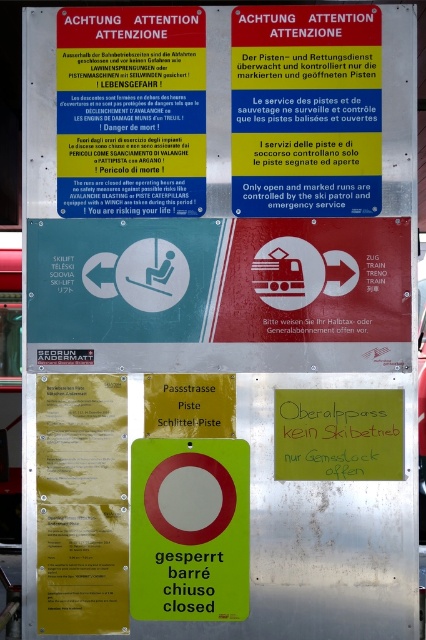
Question: Which object appears closest to the camera in this image?

Choices:
 (A) green matte sign at center
 (B) green paper sign at center

Answer: (A)

Question: Can you confirm if red plastic sign at upper center is positioned below green paper sign at center?

Choices:
 (A) yes
 (B) no

Answer: (B)

Question: Where is green matte sign at center located in relation to green paper sign at center in the image?

Choices:
 (A) left
 (B) right

Answer: (A)

Question: Does red plastic sign at upper center have a lesser width compared to green paper sign at center?

Choices:
 (A) no
 (B) yes

Answer: (A)

Question: Which point appears farthest from the camera in this image?

Choices:
 (A) (377, 442)
 (B) (172, 204)
 (C) (235, 566)

Answer: (B)

Question: Which point appears farthest from the camera in this image?

Choices:
 (A) (233, 456)
 (B) (60, 81)
 (C) (325, 422)

Answer: (B)